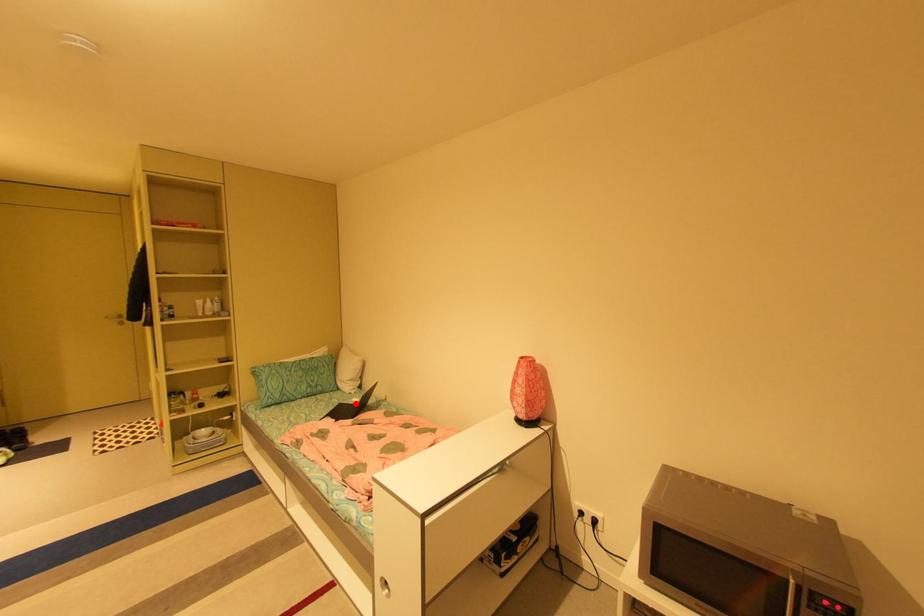
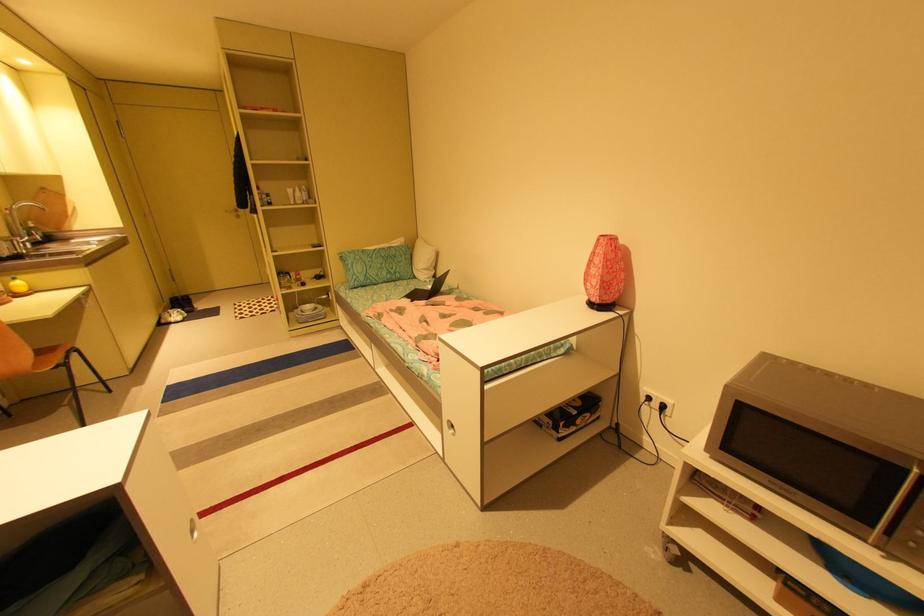
Question: I am providing you with two images of the same scene from different viewpoints. A red point is shown in image1. For the corresponding object point in image2, is it positioned nearer or farther from the camera?

Choices:
 (A) Nearer
 (B) Farther

Answer: (A)